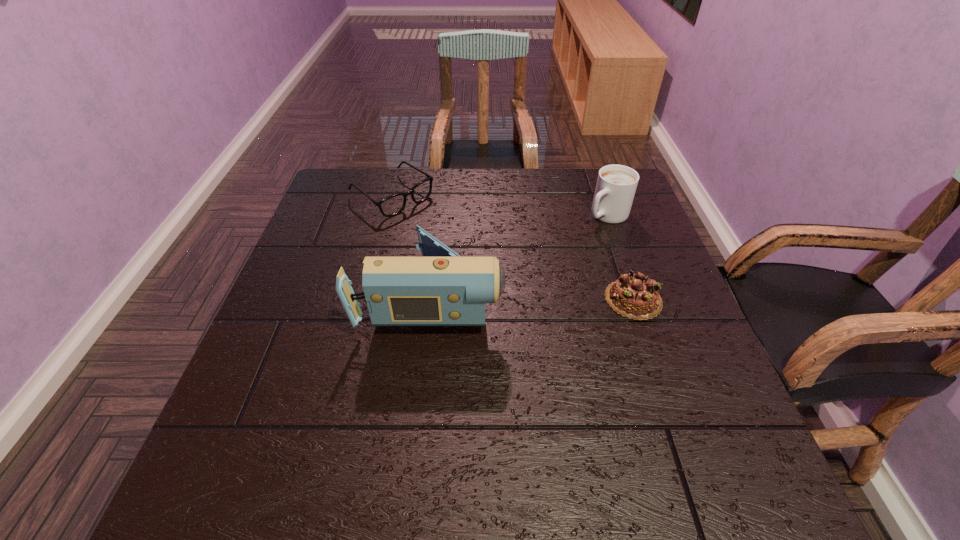
This screenshot has width=960, height=540. What are the coordinates of `free region located 0.090m on the front-facing side of the spectacles` in the screenshot? It's located at (439, 228).

Find the location of a particular element. free region located on the front-facing side of the spectacles is located at coordinates (524, 287).

Identify the location of cappuccino present at the far edge. The image size is (960, 540). (616, 185).

In order to click on spectacles located at the far edge in this screenshot , I will do `click(392, 205)`.

Locate an element on the screen. This screenshot has width=960, height=540. object that is at the left edge is located at coordinates (392, 205).

The width and height of the screenshot is (960, 540). What are the coordinates of `chocolate cake present at the right edge` in the screenshot? It's located at (635, 296).

Identify the location of cappuccino positioned at the right edge. This screenshot has width=960, height=540. (616, 185).

Locate an element on the screen. object at the far left corner is located at coordinates (392, 205).

Where is `object that is at the far right corner`? This screenshot has height=540, width=960. object that is at the far right corner is located at coordinates (616, 185).

At what (x,y) coordinates should I click in order to perform the action: click on vacant area at the far edge. Please return your answer as a coordinate pair (x, y). The width and height of the screenshot is (960, 540). Looking at the image, I should click on (481, 177).